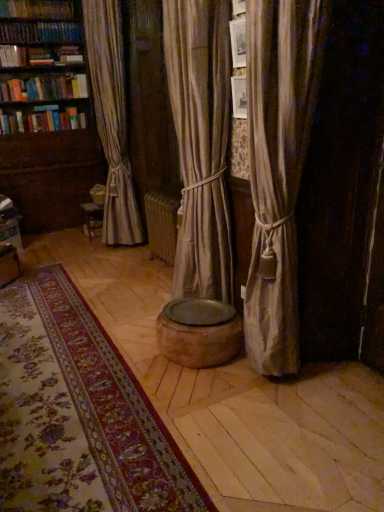
Question: Can hardcover book at upper left be found inside floral carpet at center?

Choices:
 (A) no
 (B) yes

Answer: (A)

Question: Considering the relative positions of floral carpet at center and hardcover book at upper left in the image provided, is floral carpet at center to the left of hardcover book at upper left from the viewer's perspective?

Choices:
 (A) no
 (B) yes

Answer: (A)

Question: Considering the relative sizes of floral carpet at center and hardcover book at upper left in the image provided, is floral carpet at center bigger than hardcover book at upper left?

Choices:
 (A) no
 (B) yes

Answer: (B)

Question: Is floral carpet at center shorter than hardcover book at upper left?

Choices:
 (A) yes
 (B) no

Answer: (A)

Question: Can you confirm if floral carpet at center is wider than hardcover book at upper left?

Choices:
 (A) no
 (B) yes

Answer: (B)

Question: Is floral carpet at center far away from hardcover book at upper left?

Choices:
 (A) yes
 (B) no

Answer: (A)

Question: Is silky beige curtain at right facing towards hardcover book at upper left?

Choices:
 (A) no
 (B) yes

Answer: (A)

Question: Is silky beige curtain at right positioned beyond the bounds of hardcover book at upper left?

Choices:
 (A) yes
 (B) no

Answer: (A)

Question: From the image's perspective, does silky beige curtain at right appear lower than hardcover book at upper left?

Choices:
 (A) no
 (B) yes

Answer: (B)

Question: Is silky beige curtain at right far away from hardcover book at upper left?

Choices:
 (A) yes
 (B) no

Answer: (A)

Question: Is silky beige curtain at right smaller than hardcover book at upper left?

Choices:
 (A) no
 (B) yes

Answer: (A)

Question: Is hardcover book at upper left a part of silky beige curtain at right?

Choices:
 (A) no
 (B) yes

Answer: (A)

Question: Considering the relative sizes of wooden bookshelf at left and hardcover book at upper left in the image provided, is wooden bookshelf at left shorter than hardcover book at upper left?

Choices:
 (A) no
 (B) yes

Answer: (A)